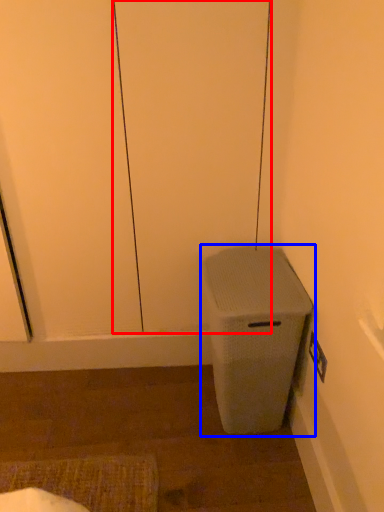
Question: Which object appears closest to the camera in this image, screen door (highlighted by a red box) or waste container (highlighted by a blue box)?

Choices:
 (A) screen door
 (B) waste container

Answer: (A)